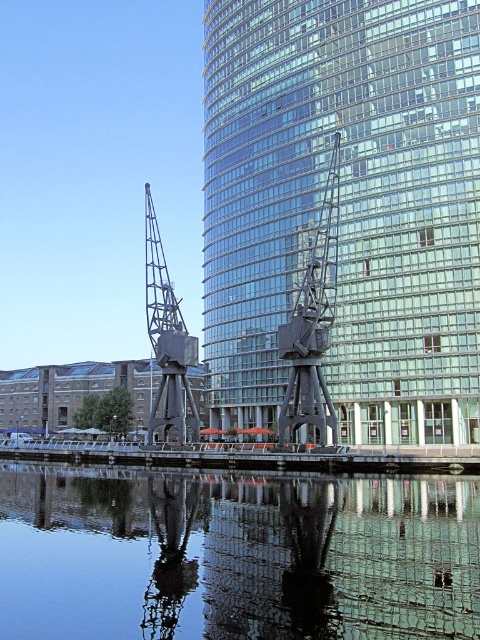
Question: Is the position of glassy steel tower at center less distant than that of dark gray metallic sculpture at center?

Choices:
 (A) no
 (B) yes

Answer: (A)

Question: Where is glassy steel tower at center located in relation to smooth concrete dock at center in the image?

Choices:
 (A) right
 (B) left

Answer: (A)

Question: Does transparent glass water at center appear under dark gray metallic sculpture at center?

Choices:
 (A) no
 (B) yes

Answer: (B)

Question: Which of these objects is positioned closest to the smooth concrete dock at center?

Choices:
 (A) glassy steel tower at center
 (B) metallic industrial crane at center
 (C) dark gray metallic sculpture at center
 (D) transparent glass water at center

Answer: (B)

Question: Which object appears closest to the camera in this image?

Choices:
 (A) smooth concrete dock at center
 (B) transparent glass water at center

Answer: (B)

Question: Which object is closer to the camera taking this photo?

Choices:
 (A) smooth concrete dock at center
 (B) metallic industrial crane at center
 (C) dark gray metallic sculpture at center
 (D) transparent glass water at center

Answer: (D)